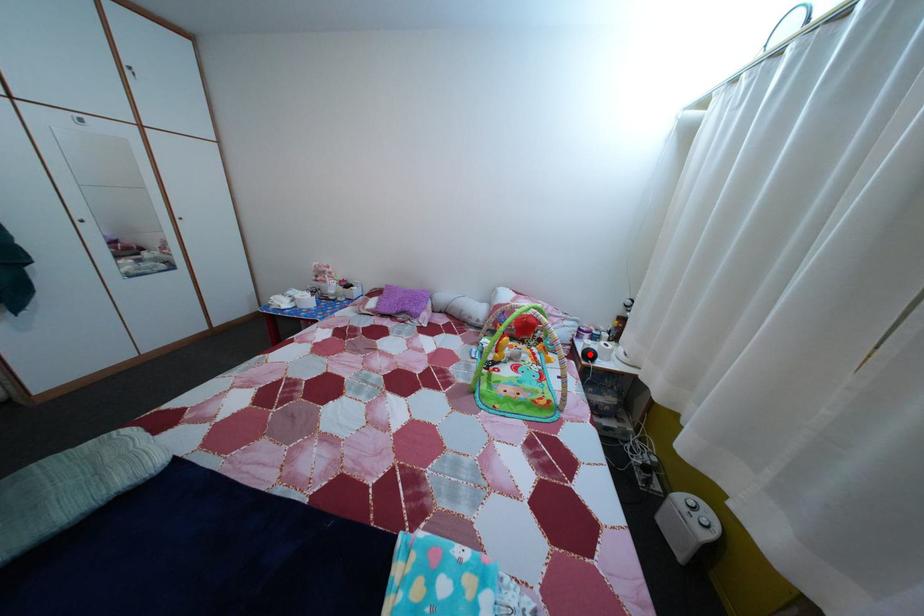
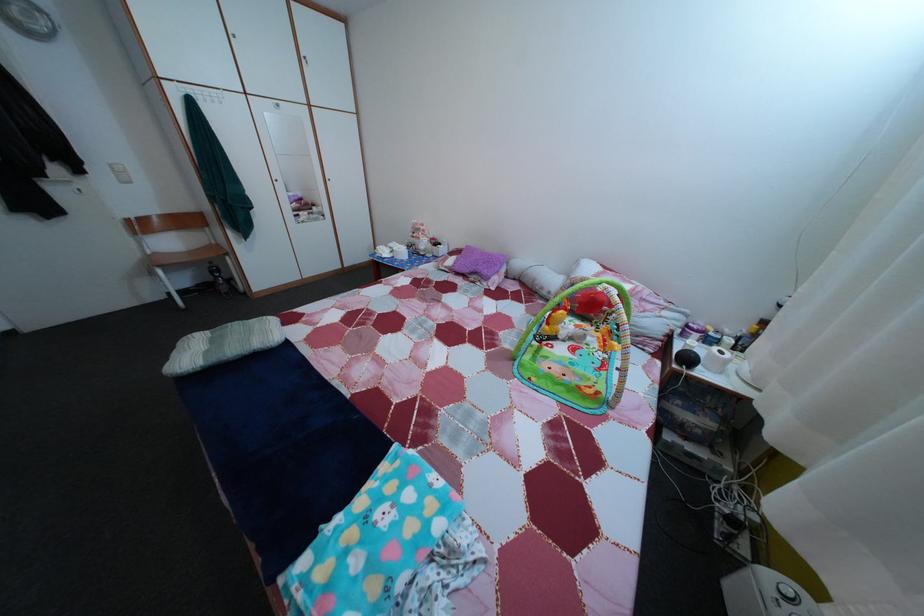
Question: I am providing you with two images of the same scene from different viewpoints. A red point is shown in image1. For the corresponding object point in image2, is it positioned nearer or farther from the camera?

Choices:
 (A) Nearer
 (B) Farther

Answer: (A)